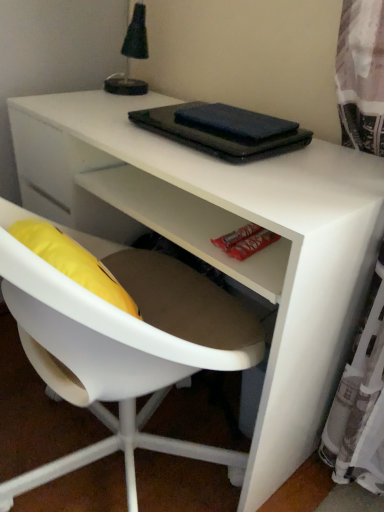
Question: Can you confirm if black matte notebook at center, the 2th notebook positioned from the top, is taller than black fabric lampshade at upper left?

Choices:
 (A) no
 (B) yes

Answer: (A)

Question: Considering the relative sizes of black matte notebook at center, the 2th notebook positioned from the top, and black fabric lampshade at upper left in the image provided, is black matte notebook at center, the 2th notebook positioned from the top, bigger than black fabric lampshade at upper left?

Choices:
 (A) no
 (B) yes

Answer: (A)

Question: From the image's perspective, is black matte notebook at center, the 2th notebook positioned from the top, on top of black fabric lampshade at upper left?

Choices:
 (A) no
 (B) yes

Answer: (A)

Question: Is black matte notebook at center, which is the first notebook from bottom to top, to the left of black fabric lampshade at upper left from the viewer's perspective?

Choices:
 (A) no
 (B) yes

Answer: (A)

Question: Can you confirm if black matte notebook at center, which is the first notebook from bottom to top, is shorter than black fabric lampshade at upper left?

Choices:
 (A) yes
 (B) no

Answer: (A)

Question: Do you think black fabric lampshade at upper left is within dark blue matte notebook at upper center, the second notebook positioned from the bottom, or outside of it?

Choices:
 (A) outside
 (B) inside

Answer: (A)

Question: From a real-world perspective, is black fabric lampshade at upper left above or below dark blue matte notebook at upper center, the second notebook positioned from the bottom?

Choices:
 (A) below
 (B) above

Answer: (B)

Question: Looking at their shapes, would you say black fabric lampshade at upper left is wider or thinner than dark blue matte notebook at upper center, which appears as the first notebook when viewed from the top?

Choices:
 (A) wide
 (B) thin

Answer: (A)

Question: Considering the positions of point (144, 57) and point (193, 128), is point (144, 57) closer or farther from the camera than point (193, 128)?

Choices:
 (A) closer
 (B) farther

Answer: (B)

Question: Is black matte notebook at center, which is the first notebook from bottom to top, in front of or behind white plastic chair at center in the image?

Choices:
 (A) front
 (B) behind

Answer: (B)

Question: From a real-world perspective, relative to white plastic chair at center, is black matte notebook at center, the 2th notebook positioned from the top, vertically above or below?

Choices:
 (A) above
 (B) below

Answer: (A)

Question: Visually, is black matte notebook at center, the 2th notebook positioned from the top, positioned to the left or to the right of white plastic chair at center?

Choices:
 (A) right
 (B) left

Answer: (A)

Question: From the image's perspective, is black matte notebook at center, which is the first notebook from bottom to top, located above or below white plastic chair at center?

Choices:
 (A) above
 (B) below

Answer: (A)

Question: Based on their positions, is dark blue matte notebook at upper center, the second notebook positioned from the bottom, located to the left or right of black fabric lampshade at upper left?

Choices:
 (A) right
 (B) left

Answer: (A)

Question: Choose the correct answer: Is dark blue matte notebook at upper center, which appears as the first notebook when viewed from the top, inside black fabric lampshade at upper left or outside it?

Choices:
 (A) outside
 (B) inside

Answer: (A)